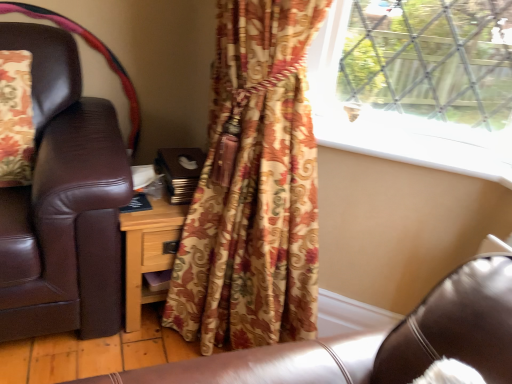
Locate an element on the screen. free space above white smooth window sill at upper center (from a real-world perspective) is located at coordinates (413, 133).